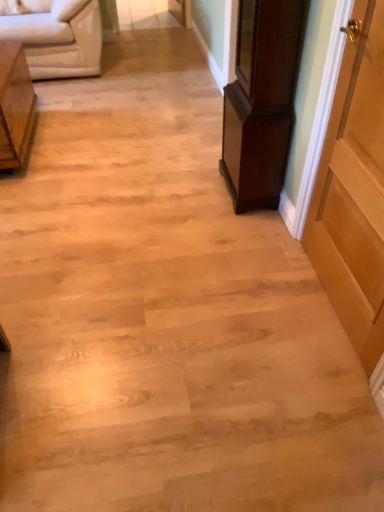
Where is `dark wood cabinet at right, which ranks as the 2th furniture in left-to-right order`? This screenshot has width=384, height=512. dark wood cabinet at right, which ranks as the 2th furniture in left-to-right order is located at coordinates (261, 101).

The height and width of the screenshot is (512, 384). What do you see at coordinates (354, 192) in the screenshot? I see `light brown wood door at right` at bounding box center [354, 192].

In order to face light brown wood door at right, should I rotate leftwards or rightwards?

Rotate your view right by about 21.523°.

This screenshot has height=512, width=384. What are the coordinates of `white leather studio couch at upper left` in the screenshot? It's located at (57, 37).

This screenshot has width=384, height=512. What do you see at coordinates (15, 105) in the screenshot? I see `light brown wood side table at left, marked as the 2th furniture in a right-to-left arrangement` at bounding box center [15, 105].

The height and width of the screenshot is (512, 384). What are the coordinates of `dark wood cabinet at right, which ranks as the 2th furniture in left-to-right order` in the screenshot? It's located at (261, 101).

Would you say white leather studio couch at upper left is a long distance from dark wood cabinet at right, which is counted as the first furniture, starting from the right?

Yes, white leather studio couch at upper left and dark wood cabinet at right, which is counted as the first furniture, starting from the right, are quite far apart.

Is white leather studio couch at upper left positioned beyond the bounds of dark wood cabinet at right, which is counted as the first furniture, starting from the right?

Yes, white leather studio couch at upper left is not within dark wood cabinet at right, which is counted as the first furniture, starting from the right.

Could you tell me if white leather studio couch at upper left is turned towards dark wood cabinet at right, which ranks as the 2th furniture in left-to-right order?

Yes, white leather studio couch at upper left is facing dark wood cabinet at right, which ranks as the 2th furniture in left-to-right order.

Which of these two, white leather studio couch at upper left or dark wood cabinet at right, which ranks as the 2th furniture in left-to-right order, is smaller?

dark wood cabinet at right, which ranks as the 2th furniture in left-to-right order, is smaller.

In the image, is light brown wood side table at left, the 1th furniture when ordered from left to right, on the left side or the right side of light brown wood door at right?

light brown wood side table at left, the 1th furniture when ordered from left to right, is positioned on light brown wood door at right's left side.

Can you confirm if light brown wood side table at left, the 1th furniture when ordered from left to right, is thinner than light brown wood door at right?

Incorrect, the width of light brown wood side table at left, the 1th furniture when ordered from left to right, is not less than that of light brown wood door at right.

Who is taller, light brown wood side table at left, marked as the 2th furniture in a right-to-left arrangement, or light brown wood door at right?

light brown wood door at right.

Which is correct: light brown wood side table at left, marked as the 2th furniture in a right-to-left arrangement, is inside light brown wood door at right, or outside of it?

light brown wood side table at left, marked as the 2th furniture in a right-to-left arrangement, is not inside light brown wood door at right, it's outside.

Are dark wood cabinet at right, which ranks as the 2th furniture in left-to-right order, and light brown wood side table at left, the 1th furniture when ordered from left to right, located far from each other?

Yes, dark wood cabinet at right, which ranks as the 2th furniture in left-to-right order, and light brown wood side table at left, the 1th furniture when ordered from left to right, are quite far apart.

Considering the positions of objects dark wood cabinet at right, which is counted as the first furniture, starting from the right, and light brown wood side table at left, marked as the 2th furniture in a right-to-left arrangement, in the image provided, who is behind, dark wood cabinet at right, which is counted as the first furniture, starting from the right, or light brown wood side table at left, marked as the 2th furniture in a right-to-left arrangement,?

light brown wood side table at left, marked as the 2th furniture in a right-to-left arrangement, is behind.

Where is `furniture below the dark wood cabinet at right, which is counted as the first furniture, starting from the right (from a real-world perspective)`? Image resolution: width=384 pixels, height=512 pixels. furniture below the dark wood cabinet at right, which is counted as the first furniture, starting from the right (from a real-world perspective) is located at coordinates (15, 105).

Can you confirm if dark wood cabinet at right, which is counted as the first furniture, starting from the right, is positioned to the right of white leather studio couch at upper left?

Yes.

Considering the sizes of objects dark wood cabinet at right, which ranks as the 2th furniture in left-to-right order, and white leather studio couch at upper left in the image provided, who is thinner, dark wood cabinet at right, which ranks as the 2th furniture in left-to-right order, or white leather studio couch at upper left?

dark wood cabinet at right, which ranks as the 2th furniture in left-to-right order.

Who is shorter, dark wood cabinet at right, which ranks as the 2th furniture in left-to-right order, or white leather studio couch at upper left?

white leather studio couch at upper left is shorter.

Locate an element on the screen. The height and width of the screenshot is (512, 384). studio couch on the left of dark wood cabinet at right, which ranks as the 2th furniture in left-to-right order is located at coordinates (57, 37).

Is light brown wood side table at left, the 1th furniture when ordered from left to right, in contact with white leather studio couch at upper left?

No.

Considering the sizes of light brown wood side table at left, marked as the 2th furniture in a right-to-left arrangement, and white leather studio couch at upper left in the image, is light brown wood side table at left, marked as the 2th furniture in a right-to-left arrangement, taller or shorter than white leather studio couch at upper left?

Clearly, light brown wood side table at left, marked as the 2th furniture in a right-to-left arrangement, is shorter compared to white leather studio couch at upper left.

From a real-world perspective, which object rests below the other?

light brown wood side table at left, the 1th furniture when ordered from left to right, from a real-world perspective.

Which of these two, light brown wood side table at left, the 1th furniture when ordered from left to right, or white leather studio couch at upper left, is bigger?

Bigger between the two is white leather studio couch at upper left.

How many degrees apart are the facing directions of dark wood cabinet at right, which is counted as the first furniture, starting from the right, and light brown wood door at right?

There is a 2.72-degree angle between the facing directions of dark wood cabinet at right, which is counted as the first furniture, starting from the right, and light brown wood door at right.

Is dark wood cabinet at right, which is counted as the first furniture, starting from the right, smaller than light brown wood door at right?

No.

Does dark wood cabinet at right, which is counted as the first furniture, starting from the right, have a lesser width compared to light brown wood door at right?

No, dark wood cabinet at right, which is counted as the first furniture, starting from the right, is not thinner than light brown wood door at right.

Between dark wood cabinet at right, which ranks as the 2th furniture in left-to-right order, and light brown wood door at right, which one appears on the right side from the viewer's perspective?

From the viewer's perspective, light brown wood door at right appears more on the right side.

Is light brown wood door at right situated inside light brown wood side table at left, marked as the 2th furniture in a right-to-left arrangement, or outside?

light brown wood door at right is not inside light brown wood side table at left, marked as the 2th furniture in a right-to-left arrangement, it's outside.

Consider the image. Are light brown wood door at right and light brown wood side table at left, marked as the 2th furniture in a right-to-left arrangement, located far from each other?

Yes.

Can you confirm if light brown wood door at right is bigger than light brown wood side table at left, the 1th furniture when ordered from left to right?

Incorrect, light brown wood door at right is not larger than light brown wood side table at left, the 1th furniture when ordered from left to right.

In the image, there is a dark wood cabinet at right, which ranks as the 2th furniture in left-to-right order. At what (x,y) coordinates should I click in order to perform the action: click on studio couch below it (from a real-world perspective). Please return your answer as a coordinate pair (x, y). This screenshot has height=512, width=384. Looking at the image, I should click on (57, 37).

You are a GUI agent. You are given a task and a screenshot of the screen. Output one action in this format:
    pyautogui.click(x=<x>, y=<y>)
    Task: Click on the door in front of the light brown wood side table at left, marked as the 2th furniture in a right-to-left arrangement
    
    Given the screenshot: What is the action you would take?
    coord(354,192)

Estimate the real-world distances between objects in this image. Which object is further from light brown wood side table at left, marked as the 2th furniture in a right-to-left arrangement, white leather studio couch at upper left or dark wood cabinet at right, which is counted as the first furniture, starting from the right?

dark wood cabinet at right, which is counted as the first furniture, starting from the right, is positioned further to the anchor light brown wood side table at left, marked as the 2th furniture in a right-to-left arrangement.

From the image, which object appears to be nearer to light brown wood door at right, white leather studio couch at upper left or dark wood cabinet at right, which ranks as the 2th furniture in left-to-right order?

dark wood cabinet at right, which ranks as the 2th furniture in left-to-right order, is closer to light brown wood door at right.

From the picture: Looking at the image, which one is located closer to light brown wood side table at left, the 1th furniture when ordered from left to right, dark wood cabinet at right, which is counted as the first furniture, starting from the right, or light brown wood door at right?

Among the two, dark wood cabinet at right, which is counted as the first furniture, starting from the right, is located nearer to light brown wood side table at left, the 1th furniture when ordered from left to right.

When comparing their distances from light brown wood side table at left, the 1th furniture when ordered from left to right, does light brown wood door at right or white leather studio couch at upper left seem further?

light brown wood door at right is positioned further to the anchor light brown wood side table at left, the 1th furniture when ordered from left to right.

Considering their positions, is light brown wood door at right positioned closer to light brown wood side table at left, the 1th furniture when ordered from left to right, than dark wood cabinet at right, which is counted as the first furniture, starting from the right?

Among the two, dark wood cabinet at right, which is counted as the first furniture, starting from the right, is located nearer to light brown wood side table at left, the 1th furniture when ordered from left to right.

From the image, which object appears to be nearer to white leather studio couch at upper left, light brown wood door at right or light brown wood side table at left, marked as the 2th furniture in a right-to-left arrangement?

Based on the image, light brown wood side table at left, marked as the 2th furniture in a right-to-left arrangement, appears to be nearer to white leather studio couch at upper left.

Estimate the real-world distances between objects in this image. Which object is further from white leather studio couch at upper left, dark wood cabinet at right, which is counted as the first furniture, starting from the right, or light brown wood door at right?

The object further to white leather studio couch at upper left is light brown wood door at right.

When comparing their distances from white leather studio couch at upper left, does light brown wood side table at left, marked as the 2th furniture in a right-to-left arrangement, or light brown wood door at right seem closer?

The object closer to white leather studio couch at upper left is light brown wood side table at left, marked as the 2th furniture in a right-to-left arrangement.

Find the location of a particular element. This screenshot has width=384, height=512. furniture located between light brown wood side table at left, marked as the 2th furniture in a right-to-left arrangement, and light brown wood door at right in the left-right direction is located at coordinates 261,101.

This screenshot has width=384, height=512. I want to click on furniture located between white leather studio couch at upper left and dark wood cabinet at right, which ranks as the 2th furniture in left-to-right order, in the left-right direction, so click(x=15, y=105).